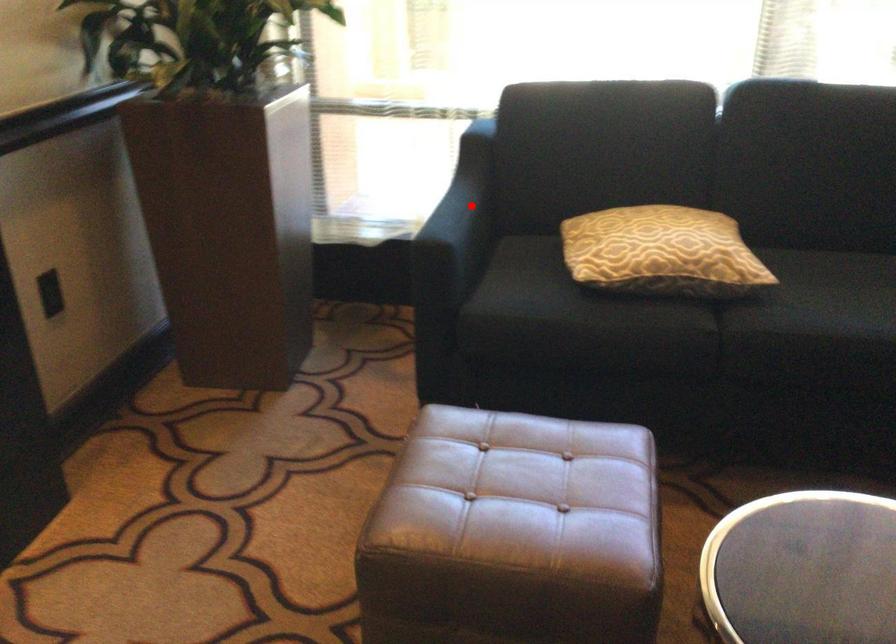
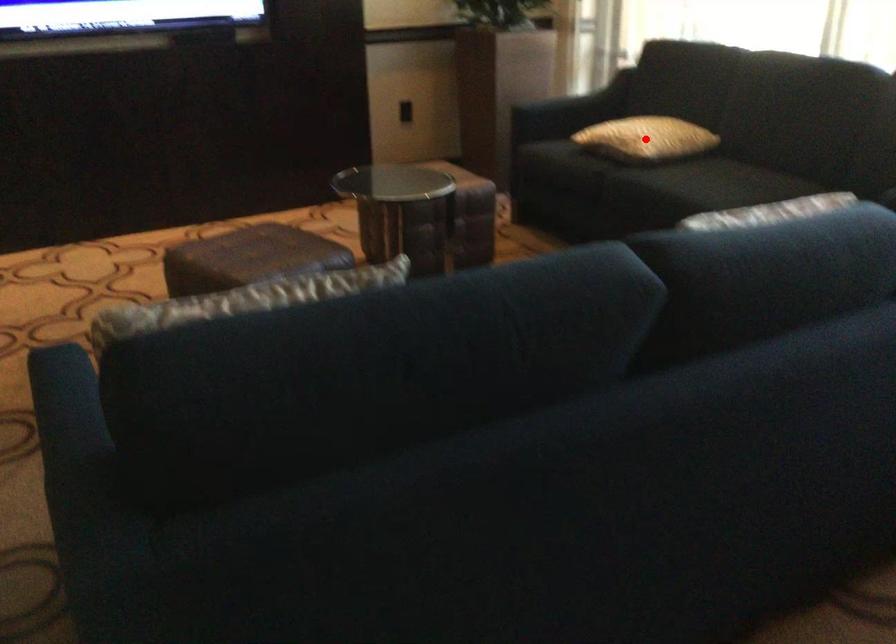
I am providing you with two images of the same scene from different viewpoints. A red point is marked on the first image and another point is marked on the second image. Do the highlighted points in image1 and image2 indicate the same real-world spot?

No